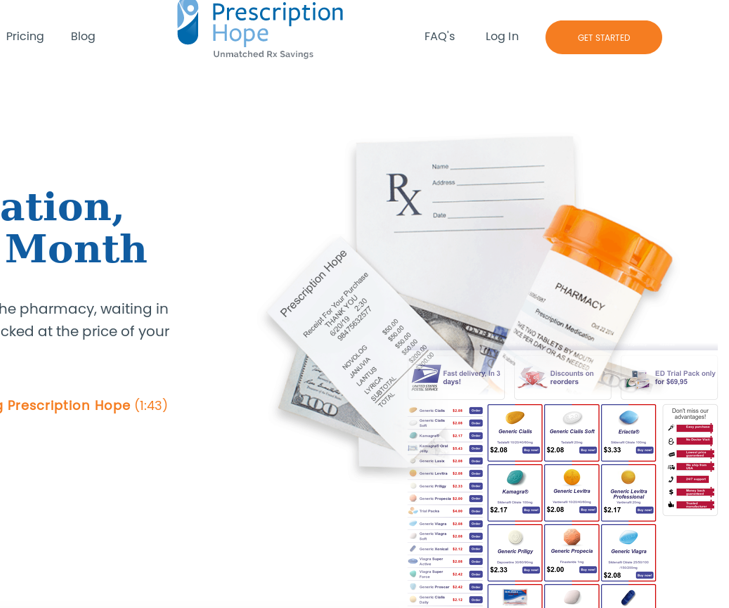
Find the location of `pill bottle`. pill bottle is located at coordinates (604, 258).